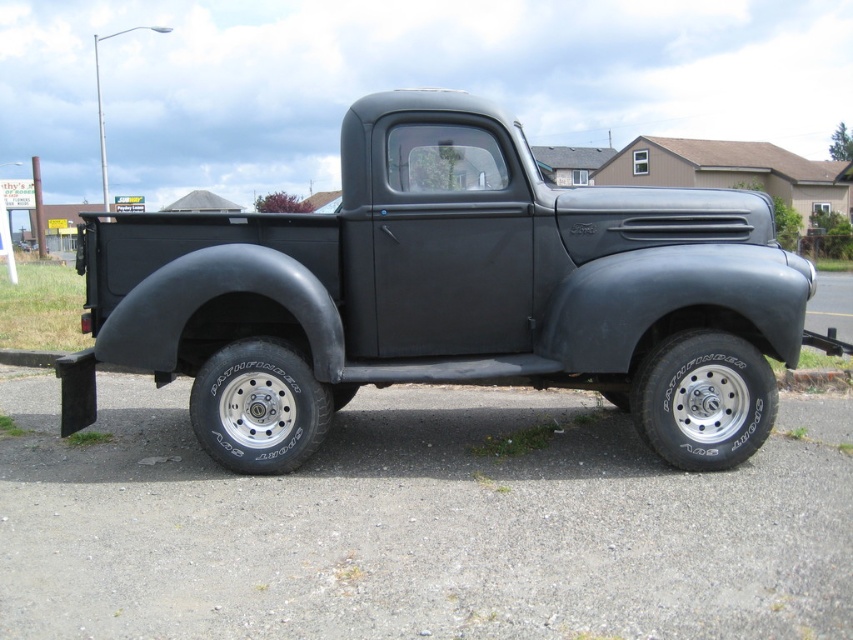
Question: Which object is farther from the camera taking this photo?

Choices:
 (A) black rubber tire at lower right
 (B) black rubber tire at lower center
 (C) matte black truck at center

Answer: (A)

Question: Can you confirm if matte black truck at center is positioned to the left of black rubber tire at lower center?

Choices:
 (A) yes
 (B) no

Answer: (B)

Question: Considering the real-world distances, which object is closest to the black rubber tire at lower center?

Choices:
 (A) black rubber tire at lower right
 (B) matte black truck at center

Answer: (B)

Question: Is the position of black rubber tire at lower right less distant than that of black rubber tire at lower center?

Choices:
 (A) yes
 (B) no

Answer: (B)

Question: Does black rubber tire at lower right appear over black rubber tire at lower center?

Choices:
 (A) no
 (B) yes

Answer: (B)

Question: Which of the following is the closest to the observer?

Choices:
 (A) black rubber tire at lower center
 (B) black rubber tire at lower right
 (C) matte black truck at center

Answer: (C)